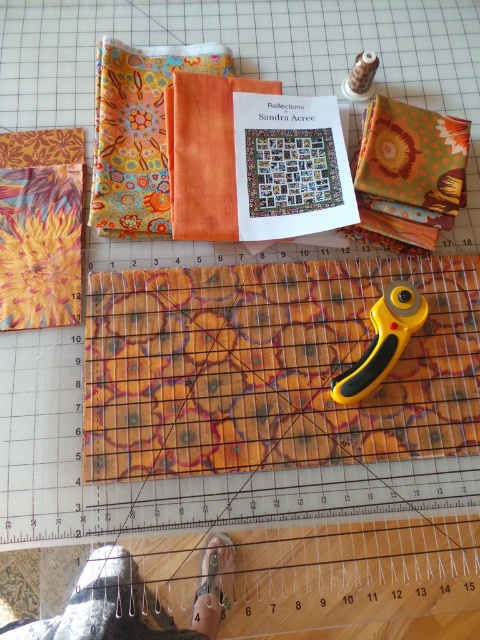
You are organizing the sewing tools on the cutting mat. The floral batik fabric at center and the yellow plastic rotary cutter at center are both on the mat. Which object is positioned to the right of the other?

The yellow plastic rotary cutter at center is to the right of the floral batik fabric at center.

You are a quilter working on this sewing table. You need to place the floral batik fabric at center and the yellow plastic rotary cutter at center on the table. Which object requires more space along the width when placing them side by side?

The floral batik fabric at center requires more space along the width when placing them side by side because its width surpasses that of the yellow plastic rotary cutter at center.